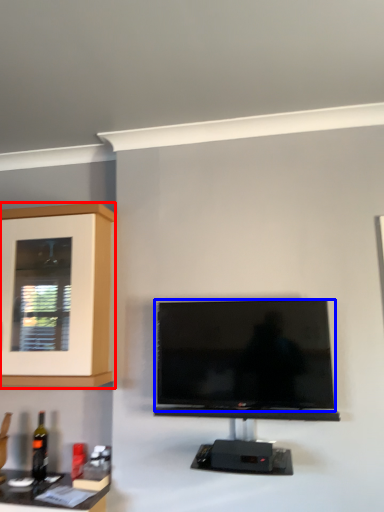
Question: Which point is closer to the camera, cabinetry (highlighted by a red box) or television (highlighted by a blue box)?

Choices:
 (A) cabinetry
 (B) television

Answer: (B)